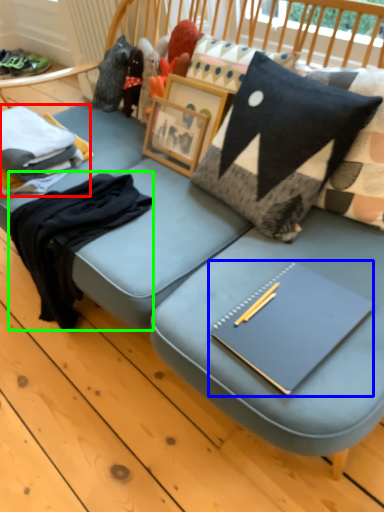
Question: Which object is the closest to the clothing (highlighted by a red box)? Choose among these: notebook (highlighted by a blue box) or clothing (highlighted by a green box).

Choices:
 (A) notebook
 (B) clothing

Answer: (B)